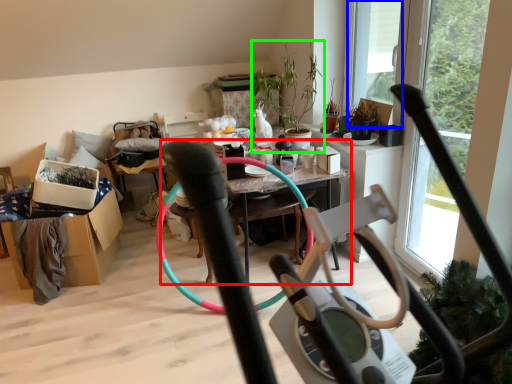
Question: Which object is the farthest from table (highlighted by a red box)? Choose among these: window screen (highlighted by a blue box) or houseplant (highlighted by a green box).

Choices:
 (A) window screen
 (B) houseplant

Answer: (A)